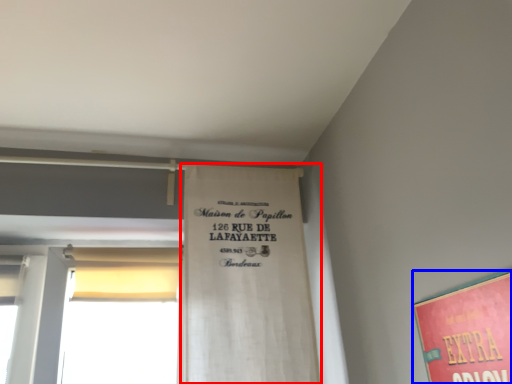
Question: Which object is closer to the camera taking this photo, bulletin board (highlighted by a red box) or poster (highlighted by a blue box)?

Choices:
 (A) bulletin board
 (B) poster

Answer: (B)